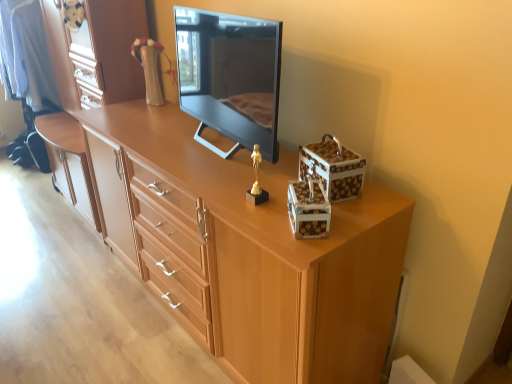
Locate an element on the screen. Image resolution: width=512 pixels, height=384 pixels. free location to the left of black glossy television at center is located at coordinates (166, 142).